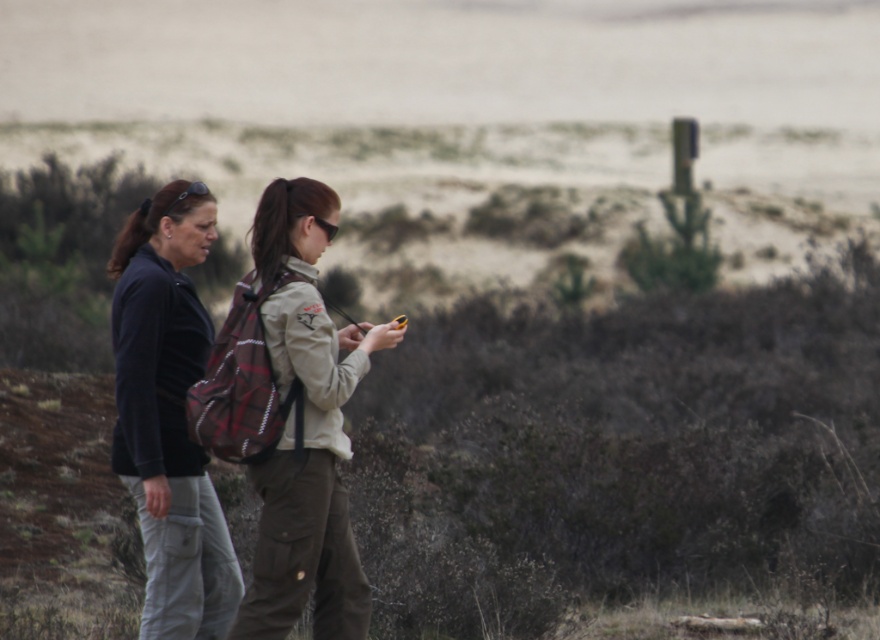
Question: Among these points, which one is nearest to the camera?

Choices:
 (A) (299, 504)
 (B) (119, 314)

Answer: (A)

Question: Does plaid fabric backpack at center appear on the left side of dark blue fleece jacket at left?

Choices:
 (A) no
 (B) yes

Answer: (A)

Question: Can you confirm if plaid fabric backpack at center is smaller than dark blue fleece jacket at left?

Choices:
 (A) yes
 (B) no

Answer: (B)

Question: Among these points, which one is farthest from the camera?

Choices:
 (A) (314, 552)
 (B) (217, 632)

Answer: (B)

Question: Does plaid fabric backpack at center appear under dark blue fleece jacket at left?

Choices:
 (A) no
 (B) yes

Answer: (B)

Question: Which of the following is the farthest from the observer?

Choices:
 (A) (145, 620)
 (B) (356, 588)

Answer: (A)